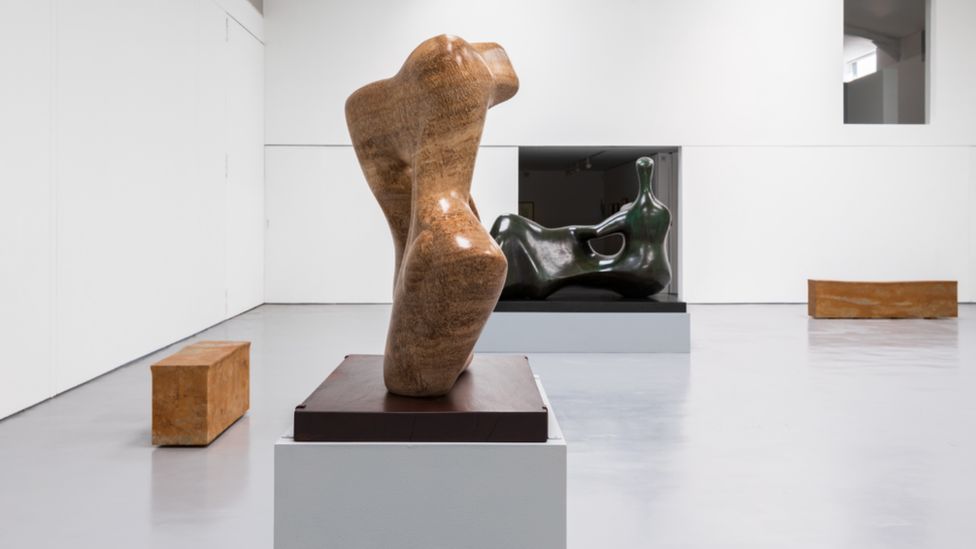
What are the coordinates of `left white wall` in the screenshot? It's located at (91, 183).